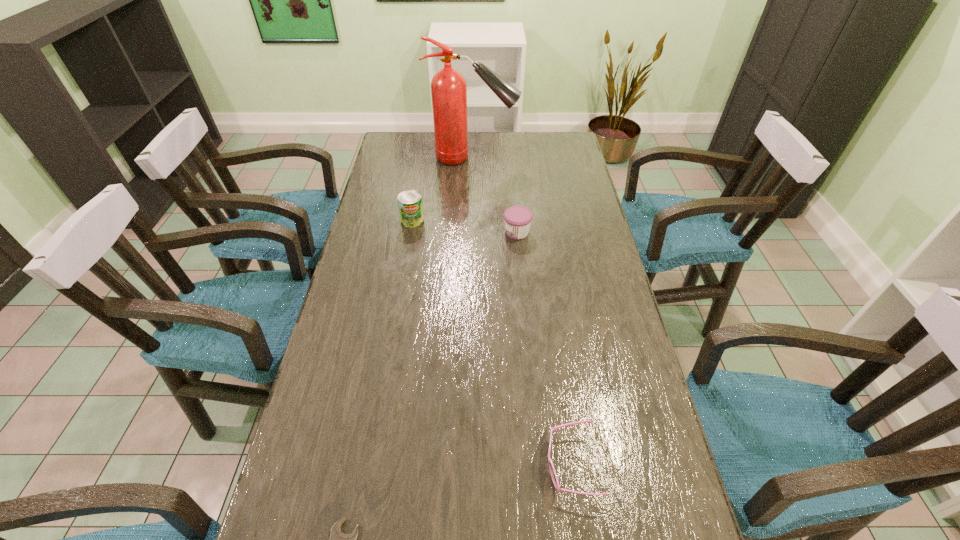
The height and width of the screenshot is (540, 960). Identify the location of vacant space located on the front label of the third tallest object. (481, 232).

Locate an element on the screen. This screenshot has width=960, height=540. free space located 0.200m on the front-facing side of the second nearest object is located at coordinates (450, 465).

Locate an element on the screen. This screenshot has width=960, height=540. vacant space situated on the front-facing side of the second nearest object is located at coordinates (364, 465).

At what (x,y) coordinates should I click in order to perform the action: click on free space located 0.400m on the front-facing side of the second nearest object. Please return your answer as a coordinate pair (x, y). This screenshot has width=960, height=540. Looking at the image, I should click on (355, 465).

Locate an element on the screen. Image resolution: width=960 pixels, height=540 pixels. object positioned at the far edge is located at coordinates (448, 87).

Find the location of `object that is at the left edge`. object that is at the left edge is located at coordinates (410, 205).

Find the location of a particular element. object that is at the right edge is located at coordinates (553, 474).

The image size is (960, 540). Identify the location of vacant space at the far edge of the desktop. (481, 154).

Where is `vacant space at the left edge of the desktop`? Image resolution: width=960 pixels, height=540 pixels. vacant space at the left edge of the desktop is located at coordinates (391, 221).

The image size is (960, 540). Identify the location of free space at the right edge of the desktop. (649, 435).